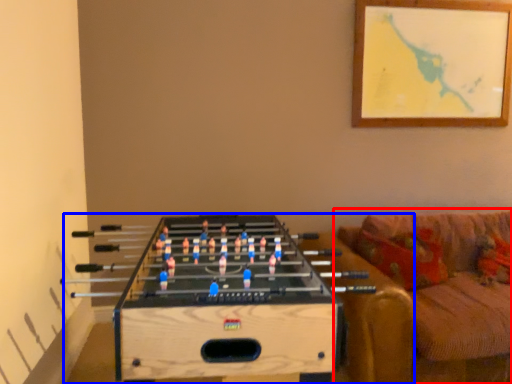
Question: Which of the following is the farthest to the observer, studio couch (highlighted by a red box) or table (highlighted by a blue box)?

Choices:
 (A) studio couch
 (B) table

Answer: (A)